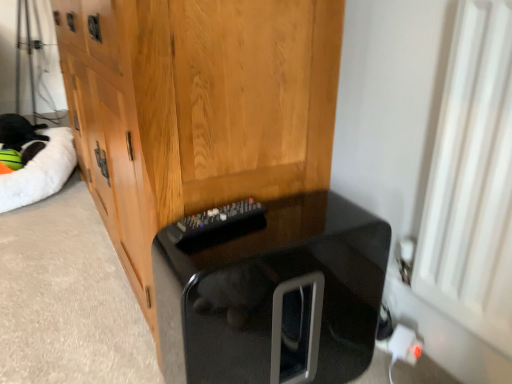
You are a GUI agent. You are given a task and a screenshot of the screen. Output one action in this format:
    pyautogui.click(x=<x>, y=<y>)
    Task: Click on the free space to the left of black glossy cat litter box at lower center
    Image resolution: width=512 pixels, height=384 pixels.
    Given the screenshot: What is the action you would take?
    pyautogui.click(x=146, y=349)